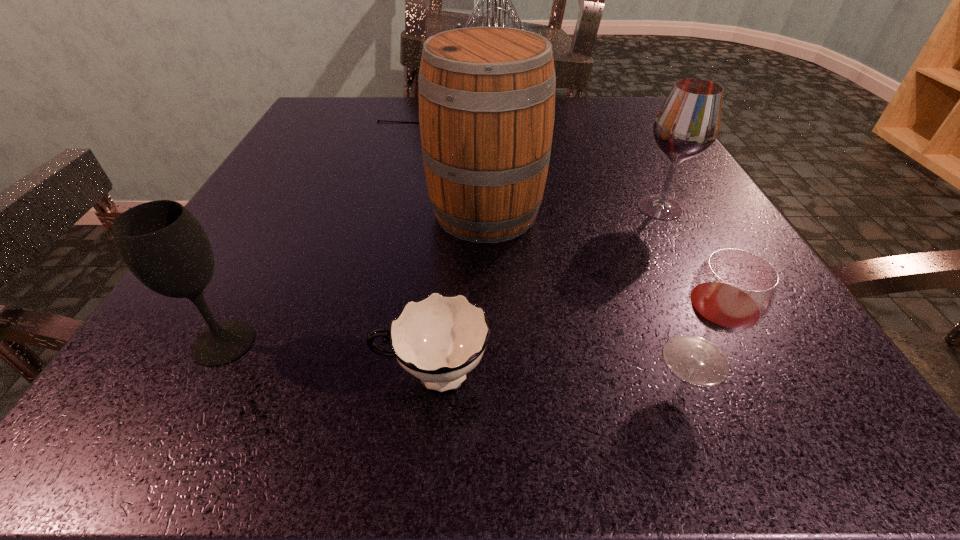
The width and height of the screenshot is (960, 540). I want to click on the closest wineglass relative to the leftmost object, so click(x=733, y=290).

This screenshot has height=540, width=960. What are the coordinates of `free space that satisfies the following two spatial constraints: 1. on the side of the cup with the handle; 2. on the back side of the cider` in the screenshot? It's located at (447, 213).

This screenshot has width=960, height=540. I want to click on free location that satisfies the following two spatial constraints: 1. on the front-facing side of the cider; 2. on the left side of the farthest object, so click(439, 213).

At what (x,y) coordinates should I click in order to perform the action: click on free spot that satisfies the following two spatial constraints: 1. on the side of the cup with the handle; 2. on the front-facing side of the fan. Please return your answer as a coordinate pair (x, y). This screenshot has width=960, height=540. Looking at the image, I should click on (456, 116).

Identify the location of free space that satisfies the following two spatial constraints: 1. on the side of the shortest object with the handle; 2. on the right side of the cider. The image size is (960, 540). point(447,213).

The height and width of the screenshot is (540, 960). I want to click on vacant region that satisfies the following two spatial constraints: 1. on the side of the cup with the handle; 2. on the left side of the cider, so click(x=447, y=213).

The width and height of the screenshot is (960, 540). Find the location of `vacant space that satisfies the following two spatial constraints: 1. on the front side of the leftmost wineglass; 2. on the side of the cup with the handle`. vacant space that satisfies the following two spatial constraints: 1. on the front side of the leftmost wineglass; 2. on the side of the cup with the handle is located at coordinates (206, 376).